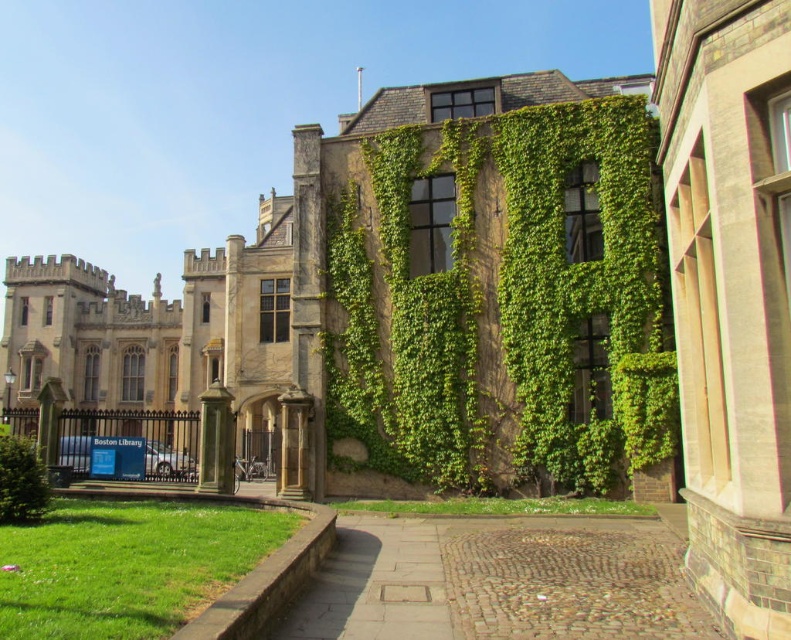
Is green textured ivy at center to the left of green leafy bush at lower left from the viewer's perspective?

In fact, green textured ivy at center is to the right of green leafy bush at lower left.

Does green textured ivy at center appear over green leafy bush at lower left?

Yes, green textured ivy at center is above green leafy bush at lower left.

Is point (551, 465) farther from camera compared to point (46, 502)?

That is True.

This screenshot has height=640, width=791. Identify the location of green textured ivy at center. (504, 304).

Which is above, cobblestone path at lower center or green leafy bush at lower left?

green leafy bush at lower left is higher up.

What do you see at coordinates (500, 582) in the screenshot? The image size is (791, 640). I see `cobblestone path at lower center` at bounding box center [500, 582].

Identify the location of cobblestone path at lower center. This screenshot has height=640, width=791. (500, 582).

Between green textured ivy at center and cobblestone path at lower center, which one is positioned lower?

Positioned lower is cobblestone path at lower center.

Between green textured ivy at center and cobblestone path at lower center, which one has less height?

cobblestone path at lower center

Between point (551, 230) and point (390, 589), which one is positioned in front?

Point (390, 589)

Identify the location of green textured ivy at center. The image size is (791, 640). (504, 304).